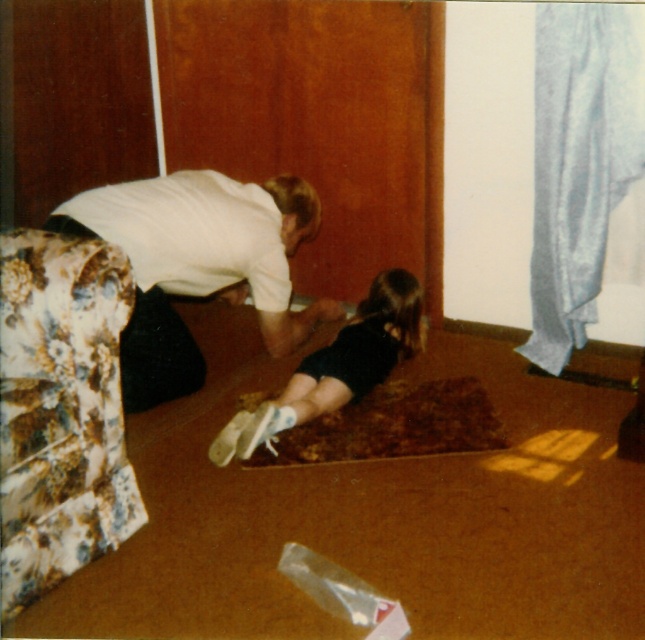
Question: Which point appears farthest from the camera in this image?

Choices:
 (A) tap(286, 276)
 (B) tap(348, 380)

Answer: (A)

Question: Does white matte shirt at center appear over black fabric dress at center?

Choices:
 (A) yes
 (B) no

Answer: (A)

Question: Which of the following is the farthest from the observer?

Choices:
 (A) white matte shirt at center
 (B) black fabric dress at center

Answer: (A)

Question: Is white matte shirt at center positioned at the back of black fabric dress at center?

Choices:
 (A) no
 (B) yes

Answer: (B)

Question: Is white matte shirt at center further to the viewer compared to black fabric dress at center?

Choices:
 (A) no
 (B) yes

Answer: (B)